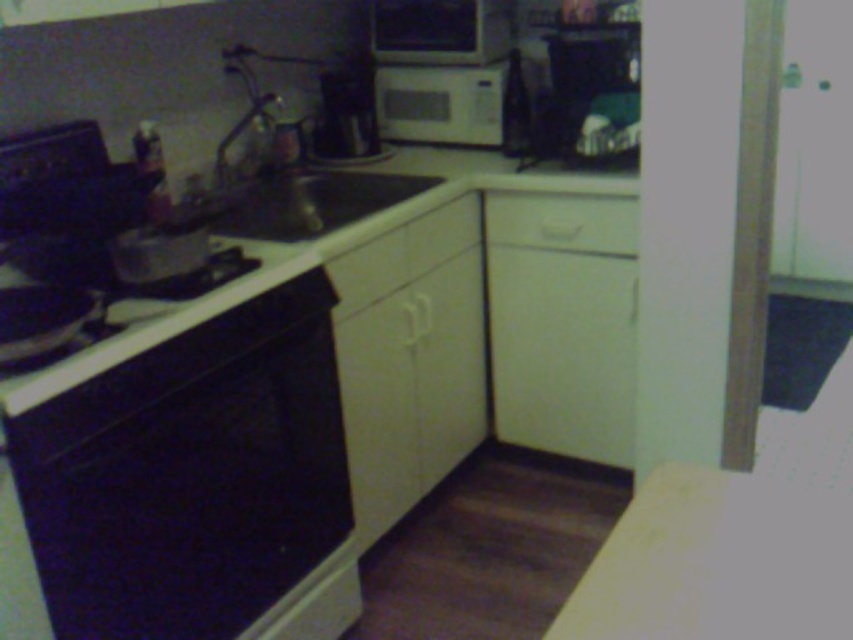
You are trying to place a rectangular cutting board on either the white matte counter top at lower right or the black glossy stove at lower left. Based on their widths, which surface can accommodate the board more comfortably?

The black glossy stove at lower left is wider than the white matte counter top at lower right, so the cutting board will fit more comfortably on the black glossy stove at lower left.

You are trying to reach the white matte drawer at center in the kitchen but there is a white matte microwave at upper center blocking your view. Can you access the drawer without moving the microwave?

The white matte microwave at upper center is further to the viewer than the white matte drawer at center, so the microwave is closer to you. This means the drawer is behind the microwave, making it inaccessible without moving the microwave.